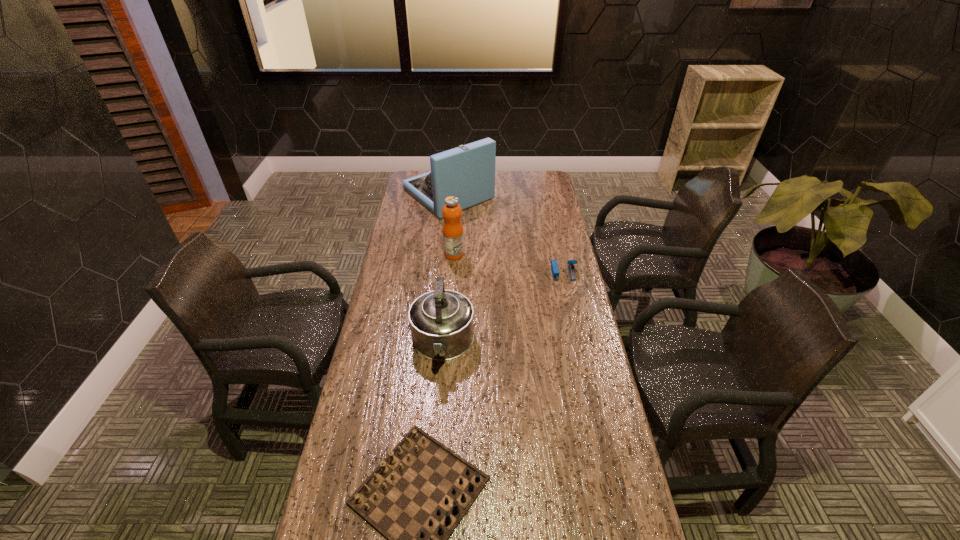
Locate an element on the screen. The height and width of the screenshot is (540, 960). the farthest object is located at coordinates (467, 172).

Find the location of a particular element. This screenshot has height=540, width=960. the fourth nearest object is located at coordinates click(453, 236).

The image size is (960, 540). In order to click on kettle in this screenshot , I will do point(442,322).

What are the coordinates of `the rightmost object` in the screenshot? It's located at (554, 266).

Identify the location of the fourth tallest object. The image size is (960, 540). (554, 266).

Identify the location of free space located 0.200m on the right of the phonograph record. (535, 194).

Locate an element on the screen. The width and height of the screenshot is (960, 540). vacant space located on the right of the fourth nearest object is located at coordinates (x=559, y=254).

Locate an element on the screen. The image size is (960, 540). free space located 0.090m with the spout at the front of the kettle is located at coordinates (438, 404).

This screenshot has width=960, height=540. In order to click on free space located 0.380m on the back of the rightmost object in this screenshot , I will do `click(550, 213)`.

The image size is (960, 540). In order to click on object positioned at the far edge in this screenshot , I will do `click(467, 172)`.